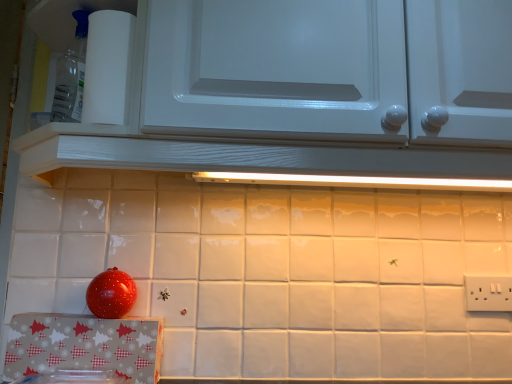
Question: Would you say white paper towel at upper left is to the left or to the right of white plastic electric outlet at lower right in the picture?

Choices:
 (A) left
 (B) right

Answer: (A)

Question: Is white paper towel at upper left wider or thinner than white plastic electric outlet at lower right?

Choices:
 (A) thin
 (B) wide

Answer: (B)

Question: Estimate the real-world distances between objects in this image. Which object is closer to the white paper towel at upper left?

Choices:
 (A) white glossy cabinet at upper center
 (B) white plastic electric outlet at lower right

Answer: (A)

Question: Considering the real-world distances, which object is farthest from the white paper towel at upper left?

Choices:
 (A) white glossy cabinet at upper center
 (B) white plastic electric outlet at lower right

Answer: (B)